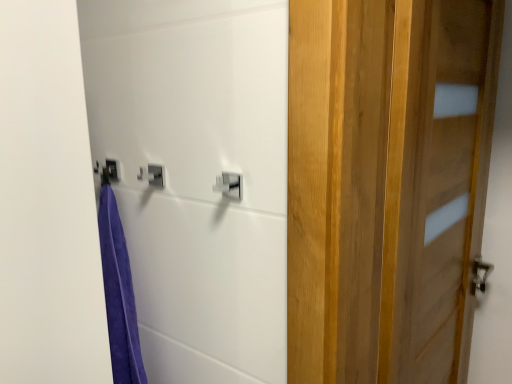
Question: In terms of height, does silver metallic lock at center look taller or shorter compared to wooden door at right?

Choices:
 (A) short
 (B) tall

Answer: (A)

Question: Is point (215, 190) positioned closer to the camera than point (328, 142)?

Choices:
 (A) closer
 (B) farther

Answer: (B)

Question: Is silver metallic lock at center wider or thinner than wooden door at right?

Choices:
 (A) thin
 (B) wide

Answer: (A)

Question: Is wooden door at right taller or shorter than silver metallic lock at center?

Choices:
 (A) tall
 (B) short

Answer: (A)

Question: Considering their positions, is wooden door at right located in front of or behind silver metallic lock at center?

Choices:
 (A) front
 (B) behind

Answer: (A)

Question: From the image's perspective, relative to silver metallic lock at center, is wooden door at right above or below?

Choices:
 (A) below
 (B) above

Answer: (A)

Question: Is wooden door at right situated inside silver metallic lock at center or outside?

Choices:
 (A) outside
 (B) inside

Answer: (A)